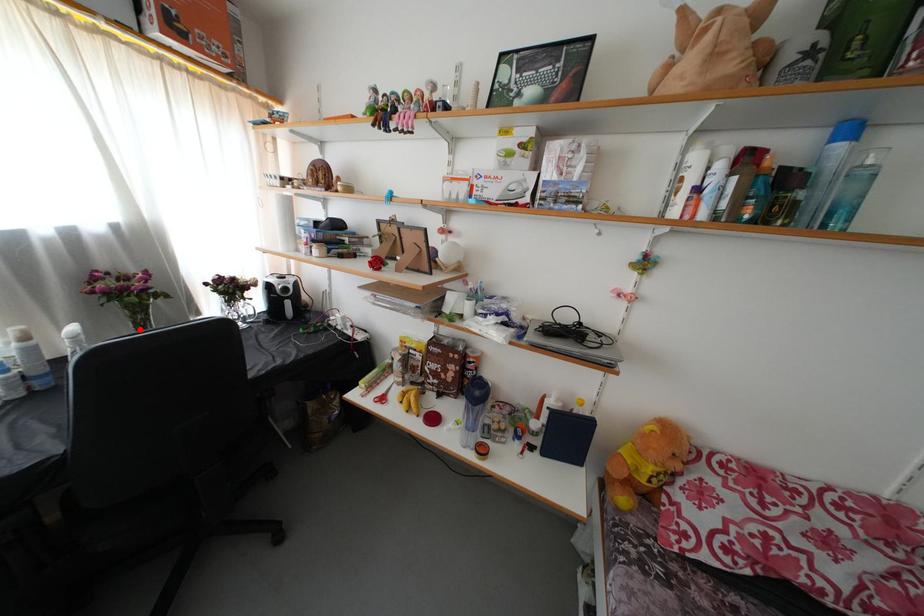
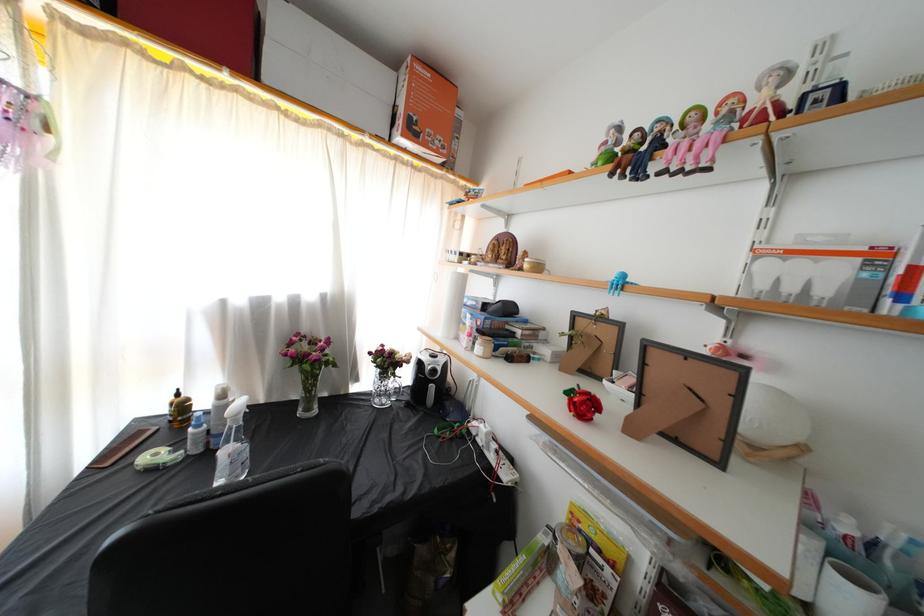
Question: I am providing you with two images of the same scene from different viewpoints. In image1, a red point is highlighted. Considering the same 3D point in image2, which of the following is correct?

Choices:
 (A) It is closer
 (B) It is farther

Answer: (B)